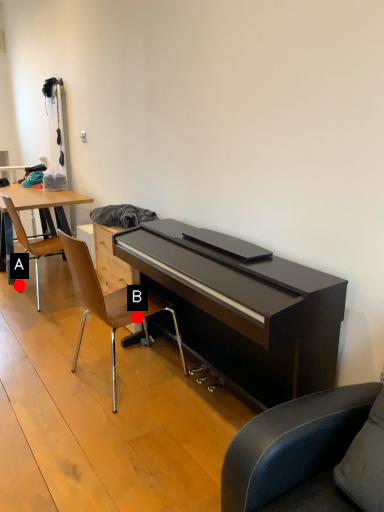
Question: Two points are circled on the image, labeled by A and B beside each circle. Which point is farther from the camera taking this photo?

Choices:
 (A) A is further
 (B) B is further

Answer: (A)